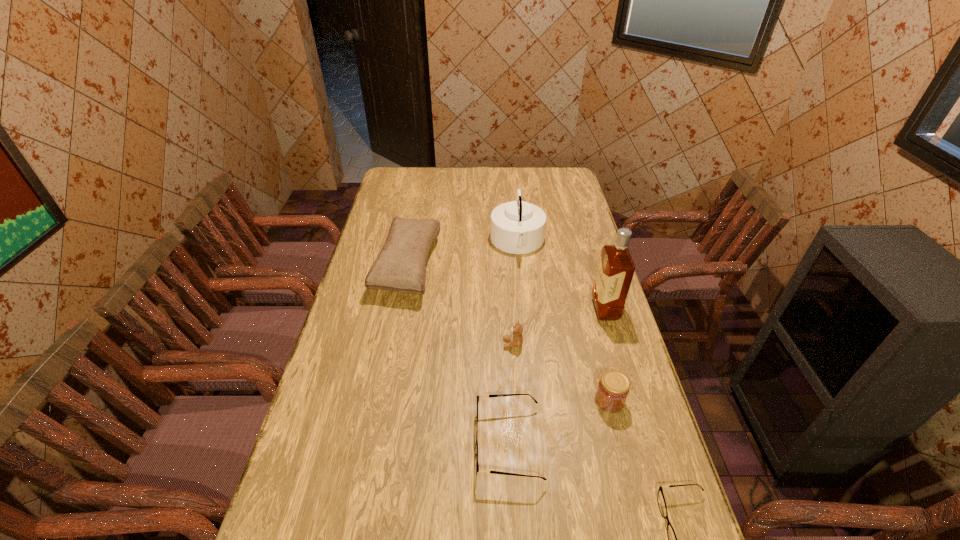
At what (x,y) coordinates should I click in order to perform the action: click on vacant space positioned 0.200m on the front-facing side of the second shortest object. Please return your answer as a coordinate pair (x, y). Looking at the image, I should click on (399, 444).

At what (x,y) coordinates should I click in order to perform the action: click on vacant space located 0.340m on the back of the jam. Please return your answer as a coordinate pair (x, y). This screenshot has width=960, height=540. Looking at the image, I should click on (585, 305).

Where is `vacant space located 0.160m on the spout of the sixth shortest object`? This screenshot has height=540, width=960. vacant space located 0.160m on the spout of the sixth shortest object is located at coordinates (451, 242).

Where is `blank space located on the spout of the sixth shortest object`? Image resolution: width=960 pixels, height=540 pixels. blank space located on the spout of the sixth shortest object is located at coordinates (456, 242).

What are the coordinates of `free space located on the spout of the sixth shortest object` in the screenshot? It's located at (393, 242).

Locate an element on the screen. This screenshot has width=960, height=540. free space located on the front label of the tallest object is located at coordinates (517, 309).

Find the location of a particular element. free space located 0.400m on the front label of the tallest object is located at coordinates (477, 309).

The height and width of the screenshot is (540, 960). I want to click on vacant space situated 0.180m on the front label of the tallest object, so click(541, 309).

Identify the location of vacant space located on the right of the cushion. The width and height of the screenshot is (960, 540). click(x=457, y=267).

Locate an element on the screen. free spot located on the front-facing side of the fourth farthest object is located at coordinates (434, 343).